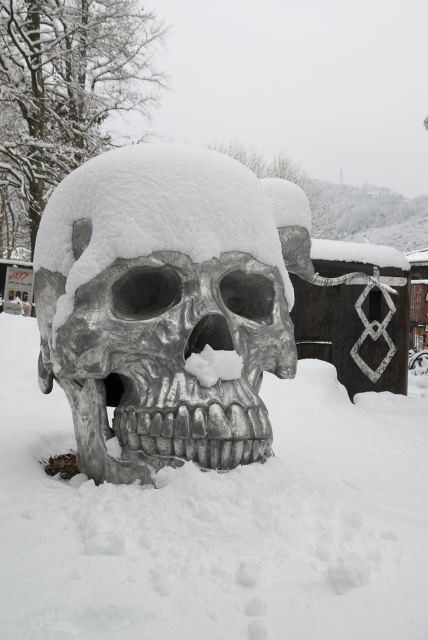
In the scene shown: You are an artist planning to paint the white frosty skull at center and the slick silver skull at center in the snowy scene. Which skull should you paint first if you want to start with the smaller one?

The white frosty skull at center has a lesser height compared to the slick silver skull at center, so you should paint the white frosty skull at center first.

You are an art student analyzing the sculpture arrangement in the snowy environment. You observe both the white frosty skull at center and the slick silver skull at center. Which one is positioned lower in the image?

The white frosty skull at center is located below the slick silver skull at center, so it is positioned lower in the image.

In the scene shown: You are an artist planning to create a replica of the skull sculpture. You have two options based on the image you see. Which one is more slender between the white frosty skull at center and the slick silver skull at center?

The white frosty skull at center is thinner than the slick silver skull at center, so the white frosty skull at center is more slender.